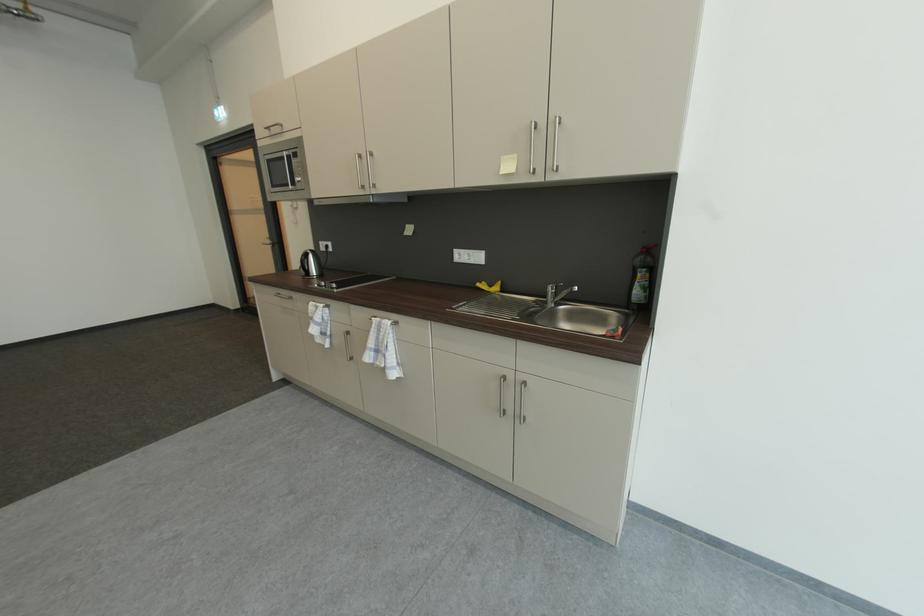
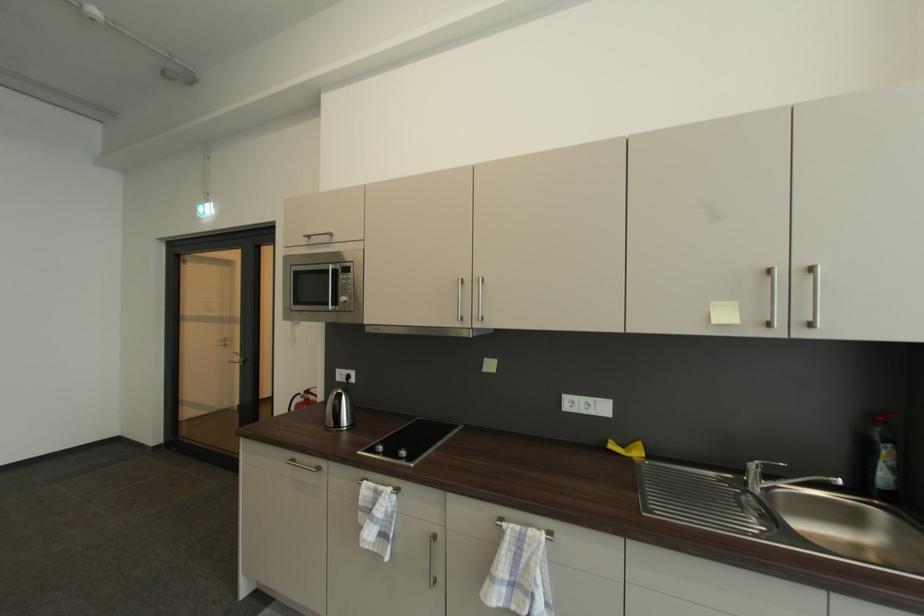
Where in the second image is the point corresponding to point 310,259 from the first image?

(344, 403)